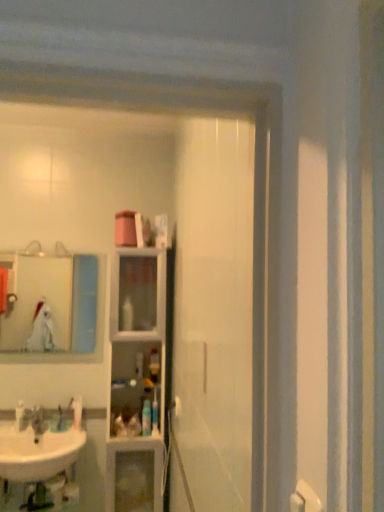
Question: Is clear glass cabinet at center outside of white glossy sink at lower left?

Choices:
 (A) no
 (B) yes

Answer: (B)

Question: Is clear glass cabinet at center shorter than white glossy sink at lower left?

Choices:
 (A) yes
 (B) no

Answer: (B)

Question: From a real-world perspective, does clear glass cabinet at center sit lower than white glossy sink at lower left?

Choices:
 (A) yes
 (B) no

Answer: (B)

Question: Does clear glass cabinet at center have a greater height compared to white glossy sink at lower left?

Choices:
 (A) no
 (B) yes

Answer: (B)

Question: Does clear glass cabinet at center come behind white glossy sink at lower left?

Choices:
 (A) no
 (B) yes

Answer: (B)

Question: Based on their positions, is translucent plastic bottle at center, which ranks as the 3th toiletry in left-to-right order, located to the left or right of white glossy sink at lower left?

Choices:
 (A) right
 (B) left

Answer: (A)

Question: In terms of height, does translucent plastic bottle at center, which ranks as the 3th toiletry in left-to-right order, look taller or shorter compared to white glossy sink at lower left?

Choices:
 (A) tall
 (B) short

Answer: (B)

Question: Considering their positions, is translucent plastic bottle at center, which ranks as the 3th toiletry in left-to-right order, located in front of or behind white glossy sink at lower left?

Choices:
 (A) behind
 (B) front

Answer: (A)

Question: In terms of size, does translucent plastic bottle at center, which ranks as the 3th toiletry in left-to-right order, appear bigger or smaller than white glossy sink at lower left?

Choices:
 (A) big
 (B) small

Answer: (B)

Question: From the image's perspective, relative to translucent plastic bottle at center, the 5th toiletry positioned from the left, is clear glass cabinet at center above or below?

Choices:
 (A) below
 (B) above

Answer: (B)

Question: Is point (163, 339) closer or farther from the camera than point (153, 410)?

Choices:
 (A) farther
 (B) closer

Answer: (A)

Question: Is clear glass cabinet at center in front of or behind translucent plastic bottle at center, the 5th toiletry positioned from the left, in the image?

Choices:
 (A) behind
 (B) front

Answer: (B)

Question: Considering the positions of clear glass cabinet at center and translucent plastic bottle at center, the 5th toiletry positioned from the left, in the image, is clear glass cabinet at center wider or thinner than translucent plastic bottle at center, the 5th toiletry positioned from the left,?

Choices:
 (A) thin
 (B) wide

Answer: (B)

Question: From their relative heights in the image, would you say matte glass mirror at upper left is taller or shorter than brushed metal faucet at lower left?

Choices:
 (A) short
 (B) tall

Answer: (B)

Question: Is matte glass mirror at upper left inside the boundaries of brushed metal faucet at lower left, or outside?

Choices:
 (A) inside
 (B) outside

Answer: (B)